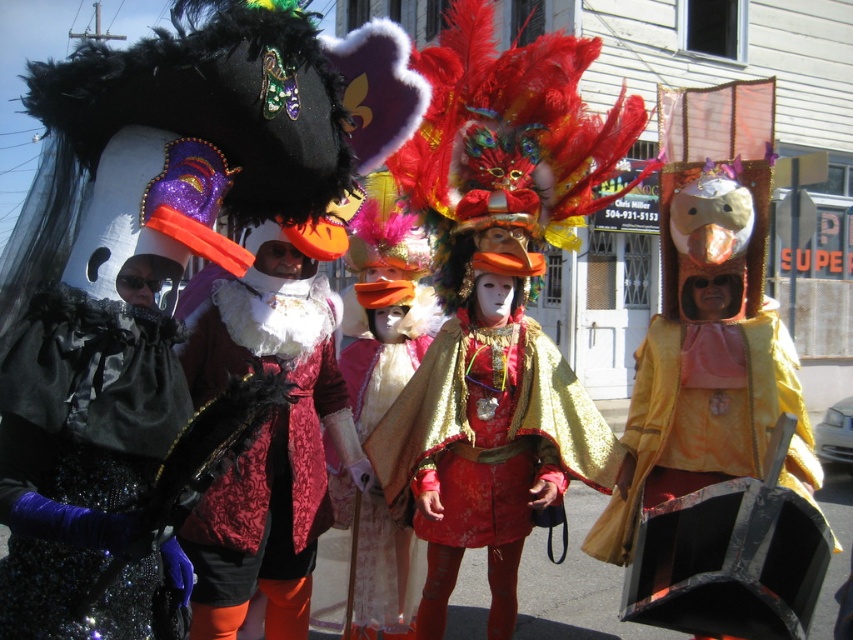
Where is the metallic gold cape at center located in the image?

The metallic gold cape at center is located at point (641, 433) in the image.

What is the 2D coordinate of the shiny black fabric at left?

The 2D coordinate of the shiny black fabric at left is at point (77, 440).